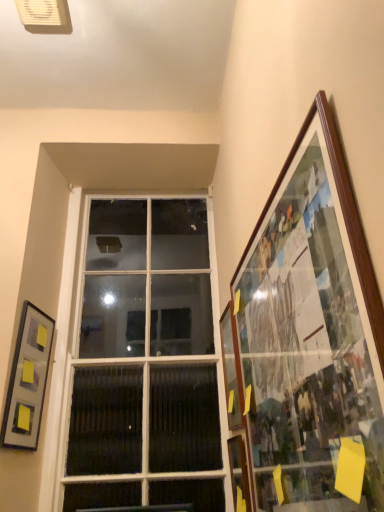
What do you see at coordinates (312, 337) in the screenshot?
I see `wooden-framed collage at right, the 1th picture frame from the right` at bounding box center [312, 337].

Describe the element at coordinates (145, 362) in the screenshot. I see `white glass window at center` at that location.

Image resolution: width=384 pixels, height=512 pixels. Find the location of `wooden picture frame at right, positioned as the second picture frame in right-to-left order`. wooden picture frame at right, positioned as the second picture frame in right-to-left order is located at coordinates (232, 369).

Find the location of a particular element. The image size is (384, 512). wooden-framed collage at right, the 1th picture frame from the right is located at coordinates (312, 337).

Is white glass window at center surrounded by wooden-framed collage at right, the 1th picture frame from the right?

No, white glass window at center is not surrounded by wooden-framed collage at right, the 1th picture frame from the right.

From the white glass window at center, count 2nd picture frame to the right and point to it. Please provide its 2D coordinates.

[(312, 337)]

Is wooden-framed collage at right, which is the 3th picture frame from left to right, oriented towards white glass window at center?

No, wooden-framed collage at right, which is the 3th picture frame from left to right, is not oriented towards white glass window at center.

Is wooden-framed collage at right, the 1th picture frame from the right, to the right of white glass window at center from the viewer's perspective?

Correct, you'll find wooden-framed collage at right, the 1th picture frame from the right, to the right of white glass window at center.

In terms of width, does wooden-framed collage at right, the 1th picture frame from the right, look wider or thinner when compared to wooden picture frame at right, which is counted as the second picture frame, starting from the left?

wooden-framed collage at right, the 1th picture frame from the right, is wider than wooden picture frame at right, which is counted as the second picture frame, starting from the left.

Is wooden-framed collage at right, which is the 3th picture frame from left to right, bigger than wooden picture frame at right, positioned as the second picture frame in right-to-left order?

Yes.

Consider the image. From the image's perspective, is wooden-framed collage at right, which is the 3th picture frame from left to right, below wooden picture frame at right, which is counted as the second picture frame, starting from the left?

Incorrect, from the image's perspective, wooden-framed collage at right, which is the 3th picture frame from left to right, is higher than wooden picture frame at right, which is counted as the second picture frame, starting from the left.

From a real-world perspective, does wooden-framed collage at right, which is the 3th picture frame from left to right, stand above wooden picture frame at right, which is counted as the second picture frame, starting from the left?

No, from a real-world perspective, wooden-framed collage at right, which is the 3th picture frame from left to right, is not on top of wooden picture frame at right, which is counted as the second picture frame, starting from the left.

Identify the location of picture frame that is the 2nd one when counting downward from the white glass window at center (from the image's perspective). This screenshot has width=384, height=512. pos(27,380).

Does point (7, 421) come farther from viewer compared to point (196, 356)?

That is False.

Is matte gray picture frame at left, marked as the 3th picture frame in a right-to-left arrangement, positioned with its back to white glass window at center?

No, matte gray picture frame at left, marked as the 3th picture frame in a right-to-left arrangement,'s orientation is not away from white glass window at center.

Can you tell me how much matte gray picture frame at left, the 1th picture frame when ordered from left to right, and wooden picture frame at right, positioned as the second picture frame in right-to-left order, differ in facing direction?

There is a 167-degree angle between the facing directions of matte gray picture frame at left, the 1th picture frame when ordered from left to right, and wooden picture frame at right, positioned as the second picture frame in right-to-left order.

Considering the sizes of objects matte gray picture frame at left, marked as the 3th picture frame in a right-to-left arrangement, and wooden picture frame at right, which is counted as the second picture frame, starting from the left, in the image provided, who is thinner, matte gray picture frame at left, marked as the 3th picture frame in a right-to-left arrangement, or wooden picture frame at right, which is counted as the second picture frame, starting from the left,?

matte gray picture frame at left, marked as the 3th picture frame in a right-to-left arrangement, is thinner.

From a real-world perspective, which object stands above the other?

From a 3D spatial view, matte gray picture frame at left, marked as the 3th picture frame in a right-to-left arrangement, is above.

Is matte gray picture frame at left, the 1th picture frame when ordered from left to right, smaller than wooden picture frame at right, positioned as the second picture frame in right-to-left order?

No, matte gray picture frame at left, the 1th picture frame when ordered from left to right, is not smaller than wooden picture frame at right, positioned as the second picture frame in right-to-left order.

Looking at this image, can you confirm if wooden picture frame at right, which is counted as the second picture frame, starting from the left, is wider than wooden-framed collage at right, the 1th picture frame from the right?

No, wooden picture frame at right, which is counted as the second picture frame, starting from the left, is not wider than wooden-framed collage at right, the 1th picture frame from the right.

Based on the photo, from the image's perspective, does wooden picture frame at right, which is counted as the second picture frame, starting from the left, appear lower than wooden-framed collage at right, the 1th picture frame from the right?

Yes, from the image's perspective, wooden picture frame at right, which is counted as the second picture frame, starting from the left, is below wooden-framed collage at right, the 1th picture frame from the right.

How different are the orientations of wooden picture frame at right, which is counted as the second picture frame, starting from the left, and wooden-framed collage at right, which is the 3th picture frame from left to right, in degrees?

There is a 0.417-degree angle between the facing directions of wooden picture frame at right, which is counted as the second picture frame, starting from the left, and wooden-framed collage at right, which is the 3th picture frame from left to right.

Which is behind, point (230, 310) or point (335, 409)?

The point (230, 310) is behind.

Do you think matte gray picture frame at left, the 1th picture frame when ordered from left to right, is within wooden-framed collage at right, the 1th picture frame from the right, or outside of it?

matte gray picture frame at left, the 1th picture frame when ordered from left to right, is spatially situated outside wooden-framed collage at right, the 1th picture frame from the right.

From the image's perspective, is matte gray picture frame at left, marked as the 3th picture frame in a right-to-left arrangement, located beneath wooden-framed collage at right, which is the 3th picture frame from left to right?

Indeed, from the image's perspective, matte gray picture frame at left, marked as the 3th picture frame in a right-to-left arrangement, is shown beneath wooden-framed collage at right, which is the 3th picture frame from left to right.

Does matte gray picture frame at left, the 1th picture frame when ordered from left to right, turn towards wooden-framed collage at right, the 1th picture frame from the right?

No, matte gray picture frame at left, the 1th picture frame when ordered from left to right, is not turned towards wooden-framed collage at right, the 1th picture frame from the right.

Find the location of a particular element. The width and height of the screenshot is (384, 512). the 3rd picture frame in front of the white glass window at center is located at coordinates (312, 337).

Considering the relative sizes of white glass window at center and wooden-framed collage at right, which is the 3th picture frame from left to right, in the image provided, is white glass window at center taller than wooden-framed collage at right, which is the 3th picture frame from left to right,?

Yes.

How many degrees apart are the facing directions of white glass window at center and wooden-framed collage at right, which is the 3th picture frame from left to right?

The angle between the facing direction of white glass window at center and the facing direction of wooden-framed collage at right, which is the 3th picture frame from left to right, is 89.2 degrees.

Are white glass window at center and wooden-framed collage at right, which is the 3th picture frame from left to right, far apart?

Actually, white glass window at center and wooden-framed collage at right, which is the 3th picture frame from left to right, are a little close together.

The width and height of the screenshot is (384, 512). In order to click on window behind the wooden-framed collage at right, which is the 3th picture frame from left to right in this screenshot , I will do `click(145, 362)`.

Where is `picture frame that appears below the wooden picture frame at right, positioned as the second picture frame in right-to-left order (from a real-world perspective)`? picture frame that appears below the wooden picture frame at right, positioned as the second picture frame in right-to-left order (from a real-world perspective) is located at coordinates (312, 337).

When comparing their distances from white glass window at center, does wooden picture frame at right, which is counted as the second picture frame, starting from the left, or matte gray picture frame at left, marked as the 3th picture frame in a right-to-left arrangement, seem closer?

Among the two, matte gray picture frame at left, marked as the 3th picture frame in a right-to-left arrangement, is located nearer to white glass window at center.

Looking at the image, which one is located further to wooden picture frame at right, which is counted as the second picture frame, starting from the left, wooden-framed collage at right, which is the 3th picture frame from left to right, or white glass window at center?

wooden-framed collage at right, which is the 3th picture frame from left to right, is further to wooden picture frame at right, which is counted as the second picture frame, starting from the left.

Which object lies further to the anchor point wooden picture frame at right, positioned as the second picture frame in right-to-left order, wooden-framed collage at right, the 1th picture frame from the right, or matte gray picture frame at left, the 1th picture frame when ordered from left to right?

matte gray picture frame at left, the 1th picture frame when ordered from left to right, is positioned further to the anchor wooden picture frame at right, positioned as the second picture frame in right-to-left order.

Based on their spatial positions, is white glass window at center or matte gray picture frame at left, the 1th picture frame when ordered from left to right, closer to wooden picture frame at right, which is counted as the second picture frame, starting from the left?

Based on the image, white glass window at center appears to be nearer to wooden picture frame at right, which is counted as the second picture frame, starting from the left.

Based on their spatial positions, is wooden picture frame at right, positioned as the second picture frame in right-to-left order, or wooden-framed collage at right, which is the 3th picture frame from left to right, closer to white glass window at center?

The object closer to white glass window at center is wooden picture frame at right, positioned as the second picture frame in right-to-left order.

Considering their positions, is wooden picture frame at right, which is counted as the second picture frame, starting from the left, positioned closer to wooden-framed collage at right, the 1th picture frame from the right, than matte gray picture frame at left, the 1th picture frame when ordered from left to right?

Based on the image, wooden picture frame at right, which is counted as the second picture frame, starting from the left, appears to be nearer to wooden-framed collage at right, the 1th picture frame from the right.

Which object lies further to the anchor point white glass window at center, matte gray picture frame at left, marked as the 3th picture frame in a right-to-left arrangement, or wooden-framed collage at right, the 1th picture frame from the right?

wooden-framed collage at right, the 1th picture frame from the right, lies further to white glass window at center than the other object.

When comparing their distances from wooden picture frame at right, positioned as the second picture frame in right-to-left order, does matte gray picture frame at left, the 1th picture frame when ordered from left to right, or white glass window at center seem further?

Based on the image, matte gray picture frame at left, the 1th picture frame when ordered from left to right, appears to be further to wooden picture frame at right, positioned as the second picture frame in right-to-left order.

Identify the location of picture frame between wooden-framed collage at right, which is the 3th picture frame from left to right, and wooden picture frame at right, positioned as the second picture frame in right-to-left order, along the z-axis. Image resolution: width=384 pixels, height=512 pixels. (27, 380).

The height and width of the screenshot is (512, 384). What are the coordinates of `window situated between matte gray picture frame at left, the 1th picture frame when ordered from left to right, and wooden picture frame at right, positioned as the second picture frame in right-to-left order, from left to right` in the screenshot? It's located at (145, 362).